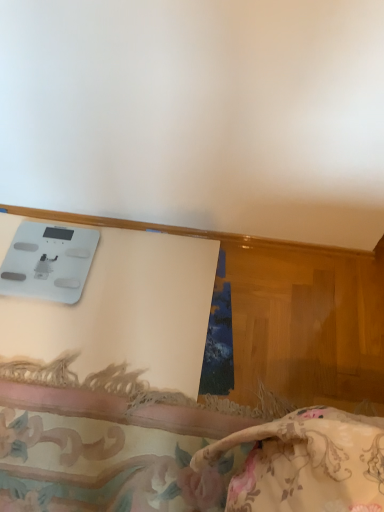
This screenshot has width=384, height=512. I want to click on free space to the left of white wood trim at upper center, so click(x=87, y=267).